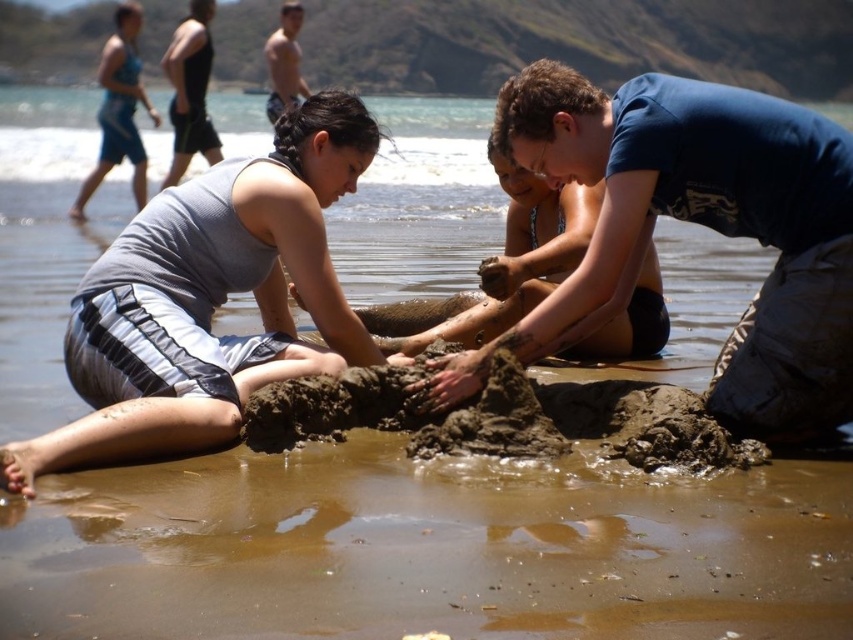
You are a photographer standing at the shoreline. You want to take a photo of the blue fabric swimsuit at upper left and the black tank top at upper left. Which one should you adjust your camera to focus on first if you want to capture both in the frame?

The blue fabric swimsuit at upper left is to the left of black tank top at upper left, so you should focus on the blue fabric swimsuit at upper left first to ensure both are in the frame.

You are standing at the camera position and want to place a flag at the nearest point between point (186, 288) and point (125, 124). Which point should you choose?

Point (186, 288) is closer to the camera than point (125, 124), so you should choose point (186, 288) to place the flag.